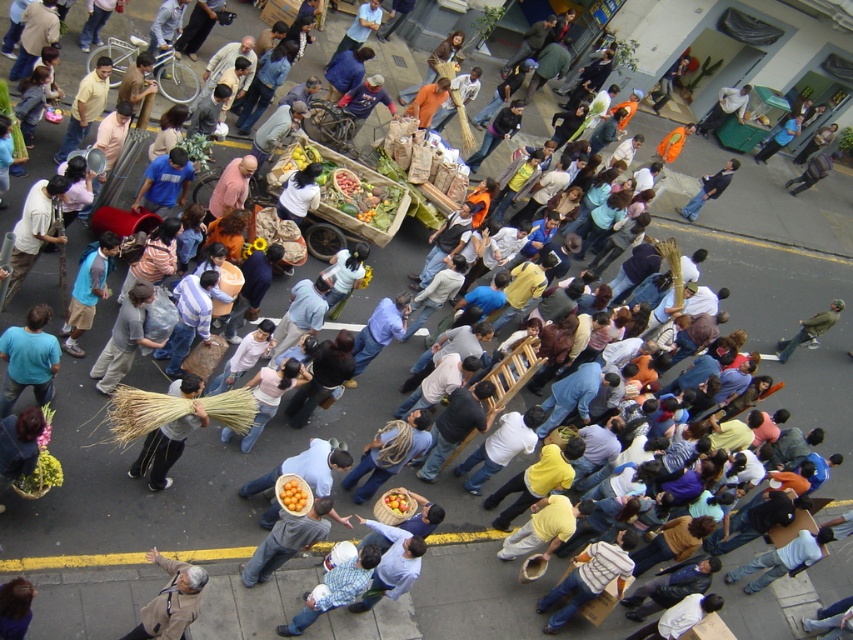
Does blue denim jeans at lower center have a lesser width compared to yellow matte oranges at center?

In fact, blue denim jeans at lower center might be wider than yellow matte oranges at center.

I want to click on blue denim jeans at lower center, so click(335, 589).

Is striped cotton shirt at lower center smaller than brown straw broom at center?

Indeed, striped cotton shirt at lower center has a smaller size compared to brown straw broom at center.

Between striped cotton shirt at lower center and brown straw broom at center, which one appears on the right side from the viewer's perspective?

From the viewer's perspective, striped cotton shirt at lower center appears more on the right side.

Is point (572, 557) positioned in front of point (189, 413)?

No, it is behind (189, 413).

The height and width of the screenshot is (640, 853). What are the coordinates of `striped cotton shirt at lower center` in the screenshot? It's located at (590, 577).

Is point (171, 614) positioned in front of point (277, 484)?

Yes.

Does light brown leather jacket at lower left have a larger size compared to yellow matte oranges at center?

Indeed, light brown leather jacket at lower left has a larger size compared to yellow matte oranges at center.

This screenshot has height=640, width=853. Find the location of `light brown leather jacket at lower left`. light brown leather jacket at lower left is located at coordinates (170, 600).

Where is `light brown leather jacket at lower left`? The height and width of the screenshot is (640, 853). light brown leather jacket at lower left is located at coordinates (170, 600).